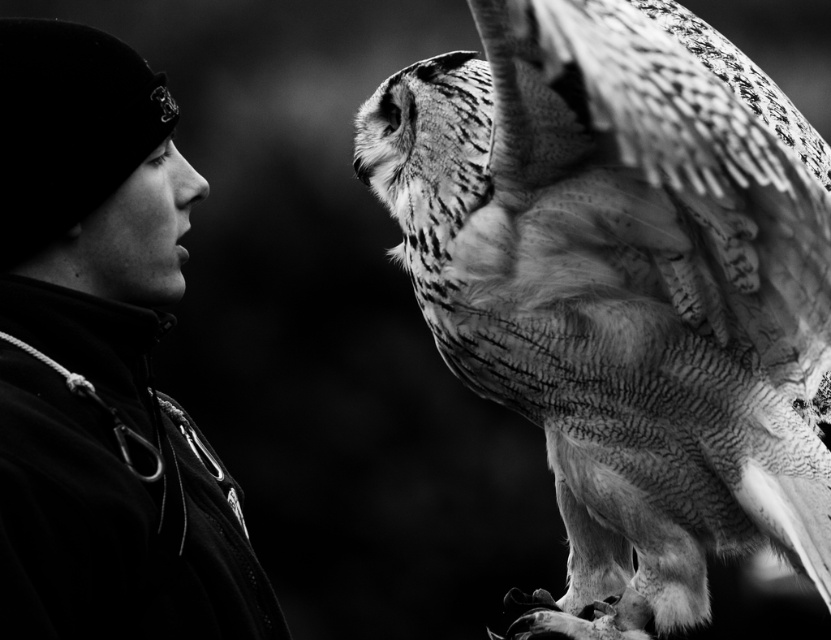
Question: In this image, where is speckled feathered owl at right located relative to dark fabric jacket at left?

Choices:
 (A) right
 (B) left

Answer: (A)

Question: Can you confirm if speckled feathered owl at right is bigger than dark fabric jacket at left?

Choices:
 (A) yes
 (B) no

Answer: (A)

Question: Can you confirm if speckled feathered owl at right is smaller than dark fabric jacket at left?

Choices:
 (A) no
 (B) yes

Answer: (A)

Question: Which object is closer to the camera taking this photo?

Choices:
 (A) speckled feathered owl at right
 (B) dark fabric jacket at left

Answer: (B)

Question: Which object is farther from the camera taking this photo?

Choices:
 (A) speckled feathered owl at right
 (B) dark fabric jacket at left

Answer: (A)